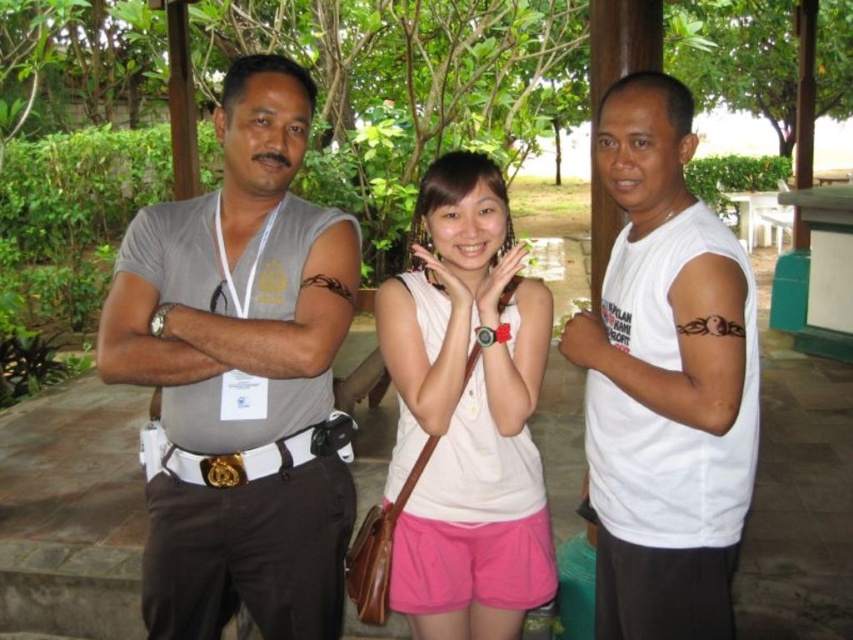
Question: Which of these objects is positioned closest to the gray matte t-shirt at left?

Choices:
 (A) white matte t-shirt at center
 (B) white matte tank top at center

Answer: (B)

Question: Based on their relative distances, which object is nearer to the white matte t-shirt at center?

Choices:
 (A) white matte tank top at center
 (B) gray matte t-shirt at left

Answer: (A)

Question: Is white matte t-shirt at center further to the viewer compared to white matte tank top at center?

Choices:
 (A) no
 (B) yes

Answer: (A)

Question: Does gray matte t-shirt at left have a lesser width compared to white matte t-shirt at center?

Choices:
 (A) yes
 (B) no

Answer: (B)

Question: In this image, where is gray matte t-shirt at left located relative to white matte tank top at center?

Choices:
 (A) above
 (B) below

Answer: (A)

Question: Estimate the real-world distances between objects in this image. Which object is closer to the white matte t-shirt at center?

Choices:
 (A) white matte tank top at center
 (B) gray matte t-shirt at left

Answer: (A)